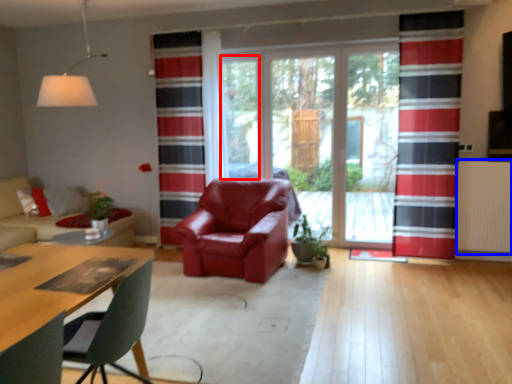
Question: Which of the following is the farthest to the observer, window screen (highlighted by a red box) or radiator (highlighted by a blue box)?

Choices:
 (A) window screen
 (B) radiator

Answer: (A)